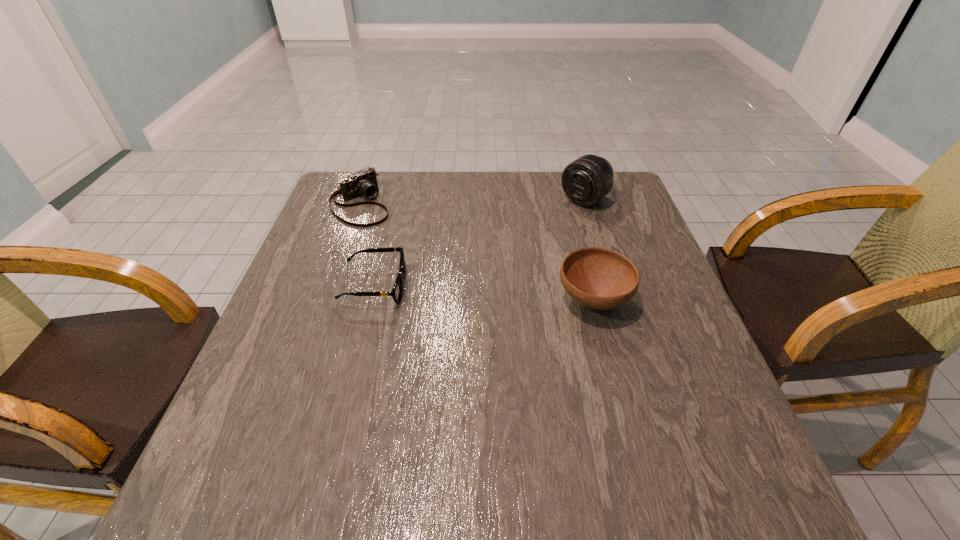
Identify the location of free space at the far edge of the desktop. (423, 193).

In the image, there is a desktop. Find the location of `vacant region at the near edge`. vacant region at the near edge is located at coordinates (599, 404).

This screenshot has height=540, width=960. I want to click on free point at the left edge, so click(331, 345).

The image size is (960, 540). Find the location of `vacant space at the right edge of the desktop`. vacant space at the right edge of the desktop is located at coordinates (673, 299).

This screenshot has width=960, height=540. I want to click on free region at the near right corner, so click(733, 419).

Locate an element on the screen. This screenshot has width=960, height=540. vacant region between the bowl and the second shortest object is located at coordinates (477, 252).

Find the location of `free space that is in between the bowl and the shortest object`. free space that is in between the bowl and the shortest object is located at coordinates (484, 293).

I want to click on free space between the shortest object and the telephoto lens, so click(480, 242).

You are a GUI agent. You are given a task and a screenshot of the screen. Output one action in this format:
    pyautogui.click(x=<x>, y=<y>)
    Task: Click on the vacant space that's between the sunglasses and the second tallest object
    The image size is (960, 540).
    Given the screenshot: What is the action you would take?
    [484, 293]

I want to click on vacant area that lies between the sunglasses and the bowl, so click(x=484, y=293).